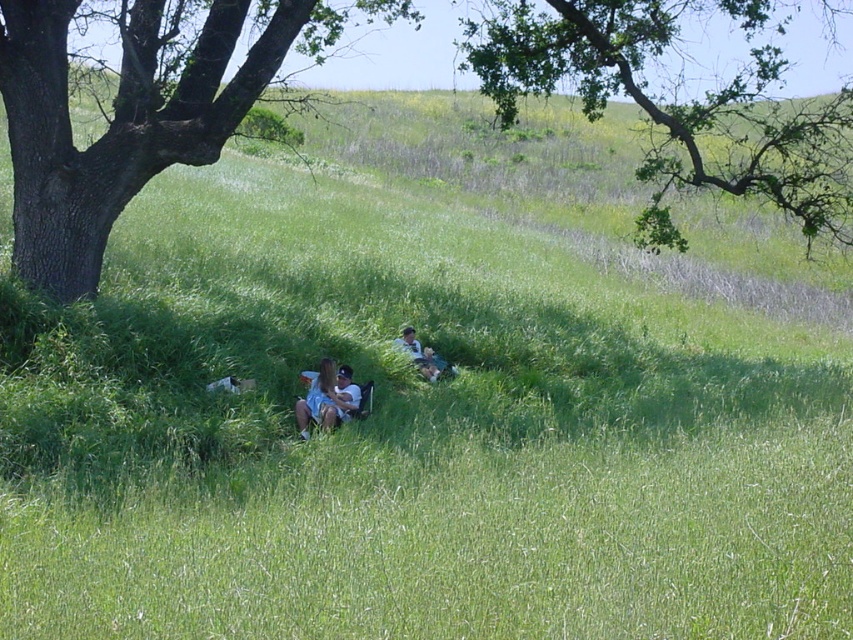
Can you confirm if green leafy tree at upper center is positioned below denim shorts at lower center?

No.

Does point (544, 13) come behind point (347, 372)?

Yes, it is behind point (347, 372).

Where is `green leafy tree at upper center`? The width and height of the screenshot is (853, 640). green leafy tree at upper center is located at coordinates 675,104.

In the scene shown: Which is above, brown rough bark tree at left or light blue denim shorts at center?

brown rough bark tree at left is above.

Does point (196, 64) lie behind point (444, 371)?

No, it is not.

The width and height of the screenshot is (853, 640). In order to click on brown rough bark tree at left in this screenshot , I will do `click(135, 112)`.

Is denim shorts at lower center to the right of light blue denim shorts at center from the viewer's perspective?

In fact, denim shorts at lower center is to the left of light blue denim shorts at center.

Based on the photo, between denim shorts at lower center and light blue denim shorts at center, which one is positioned higher?

Positioned higher is light blue denim shorts at center.

You are a GUI agent. You are given a task and a screenshot of the screen. Output one action in this format:
    pyautogui.click(x=<x>, y=<y>)
    Task: Click on the denim shorts at lower center
    This screenshot has width=853, height=640.
    Given the screenshot: What is the action you would take?
    pyautogui.click(x=326, y=397)